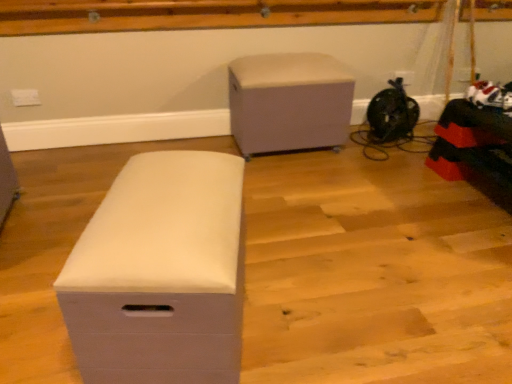
What do you see at coordinates (160, 273) in the screenshot? The height and width of the screenshot is (384, 512). I see `matte white storage box at center, marked as the 2th furniture in a back-to-front arrangement` at bounding box center [160, 273].

In order to click on matte white storage box at center, marked as the 2th furniture in a back-to-front arrangement in this screenshot , I will do `click(160, 273)`.

Where is `beige fabric ottoman at center, acting as the 1th furniture starting from the top`? Image resolution: width=512 pixels, height=384 pixels. beige fabric ottoman at center, acting as the 1th furniture starting from the top is located at coordinates (289, 102).

What is the approximate width of beige fabric ottoman at center, which is the second furniture from front to back?

It is 16.65 inches.

The image size is (512, 384). Describe the element at coordinates (289, 102) in the screenshot. I see `beige fabric ottoman at center, acting as the 1th furniture starting from the top` at that location.

Image resolution: width=512 pixels, height=384 pixels. What are the coordinates of `matte white storage box at center, marked as the 2th furniture in a back-to-front arrangement` in the screenshot? It's located at (160, 273).

Based on their positions, is beige fabric ottoman at center, positioned as the second furniture in left-to-right order, located to the left or right of matte white storage box at center, arranged as the first furniture when viewed from the left?

beige fabric ottoman at center, positioned as the second furniture in left-to-right order, is to the right of matte white storage box at center, arranged as the first furniture when viewed from the left.

Looking at this image, is beige fabric ottoman at center, marked as the 1th furniture in a right-to-left arrangement, in front of matte white storage box at center, which is counted as the second furniture, starting from the top?

No, beige fabric ottoman at center, marked as the 1th furniture in a right-to-left arrangement, is further to the viewer.

Considering the points (310, 132) and (212, 254), which point is in front, point (310, 132) or point (212, 254)?

Positioned in front is point (212, 254).

From the image's perspective, which one is positioned lower, beige fabric ottoman at center, marked as the 1th furniture in a right-to-left arrangement, or matte white storage box at center, the second furniture from the right?

matte white storage box at center, the second furniture from the right.

From a real-world perspective, is beige fabric ottoman at center, which appears as the first furniture when viewed from the back, on top of matte white storage box at center, acting as the first furniture starting from the bottom?

Correct, in the physical world, beige fabric ottoman at center, which appears as the first furniture when viewed from the back, is higher than matte white storage box at center, acting as the first furniture starting from the bottom.

Does beige fabric ottoman at center, marked as the 1th furniture in a right-to-left arrangement, have a greater width compared to matte white storage box at center, acting as the first furniture starting from the bottom?

Yes, beige fabric ottoman at center, marked as the 1th furniture in a right-to-left arrangement, is wider than matte white storage box at center, acting as the first furniture starting from the bottom.

Considering the sizes of beige fabric ottoman at center, positioned as the second furniture in left-to-right order, and matte white storage box at center, the first furniture in the front-to-back sequence, in the image, is beige fabric ottoman at center, positioned as the second furniture in left-to-right order, taller or shorter than matte white storage box at center, the first furniture in the front-to-back sequence,?

In the image, beige fabric ottoman at center, positioned as the second furniture in left-to-right order, appears to be taller than matte white storage box at center, the first furniture in the front-to-back sequence.

Based on their sizes in the image, would you say beige fabric ottoman at center, which is the second furniture from front to back, is bigger or smaller than matte white storage box at center, the first furniture in the front-to-back sequence?

Considering their sizes, beige fabric ottoman at center, which is the second furniture from front to back, takes up more space than matte white storage box at center, the first furniture in the front-to-back sequence.

Is beige fabric ottoman at center, marked as the 1th furniture in a right-to-left arrangement, inside the boundaries of matte white storage box at center, marked as the 2th furniture in a back-to-front arrangement, or outside?

beige fabric ottoman at center, marked as the 1th furniture in a right-to-left arrangement, lies outside matte white storage box at center, marked as the 2th furniture in a back-to-front arrangement.

Are beige fabric ottoman at center, which appears as the first furniture when viewed from the back, and matte white storage box at center, the second furniture from the right, located far from each other?

Yes, beige fabric ottoman at center, which appears as the first furniture when viewed from the back, and matte white storage box at center, the second furniture from the right, are quite far apart.

Is beige fabric ottoman at center, which is counted as the second furniture, starting from the bottom, aimed at matte white storage box at center, arranged as the first furniture when viewed from the left?

Yes, beige fabric ottoman at center, which is counted as the second furniture, starting from the bottom, faces towards matte white storage box at center, arranged as the first furniture when viewed from the left.

Can you tell me how much beige fabric ottoman at center, marked as the 1th furniture in a right-to-left arrangement, and matte white storage box at center, acting as the first furniture starting from the bottom, differ in facing direction?

104 degrees.

How much distance is there between beige fabric ottoman at center, acting as the 1th furniture starting from the top, and matte white storage box at center, arranged as the first furniture when viewed from the left?

They are 1.32 meters apart.

Where is `furniture above the matte white storage box at center, which is counted as the second furniture, starting from the top (from the image's perspective)`? This screenshot has height=384, width=512. furniture above the matte white storage box at center, which is counted as the second furniture, starting from the top (from the image's perspective) is located at coordinates (289, 102).

Considering the positions of objects matte white storage box at center, which is counted as the second furniture, starting from the top, and beige fabric ottoman at center, which is counted as the second furniture, starting from the bottom, in the image provided, who is more to the right, matte white storage box at center, which is counted as the second furniture, starting from the top, or beige fabric ottoman at center, which is counted as the second furniture, starting from the bottom,?

beige fabric ottoman at center, which is counted as the second furniture, starting from the bottom.

Relative to beige fabric ottoman at center, positioned as the second furniture in left-to-right order, is matte white storage box at center, the second furniture from the right, in front or behind?

In the image, matte white storage box at center, the second furniture from the right, appears in front of beige fabric ottoman at center, positioned as the second furniture in left-to-right order.

Is point (190, 273) farther from viewer compared to point (333, 87)?

No, (190, 273) is closer to viewer.

From the image's perspective, between matte white storage box at center, marked as the 2th furniture in a back-to-front arrangement, and beige fabric ottoman at center, which appears as the first furniture when viewed from the back, who is located below?

From the image's view, matte white storage box at center, marked as the 2th furniture in a back-to-front arrangement, is below.

From a real-world perspective, is matte white storage box at center, the first furniture in the front-to-back sequence, positioned under beige fabric ottoman at center, positioned as the second furniture in left-to-right order, based on gravity?

Indeed, from a real-world perspective, matte white storage box at center, the first furniture in the front-to-back sequence, is positioned beneath beige fabric ottoman at center, positioned as the second furniture in left-to-right order.

Does matte white storage box at center, marked as the 2th furniture in a back-to-front arrangement, have a lesser width compared to beige fabric ottoman at center, marked as the 1th furniture in a right-to-left arrangement?

Correct, the width of matte white storage box at center, marked as the 2th furniture in a back-to-front arrangement, is less than that of beige fabric ottoman at center, marked as the 1th furniture in a right-to-left arrangement.

Considering the sizes of objects matte white storage box at center, the first furniture in the front-to-back sequence, and beige fabric ottoman at center, which is the second furniture from front to back, in the image provided, who is taller, matte white storage box at center, the first furniture in the front-to-back sequence, or beige fabric ottoman at center, which is the second furniture from front to back,?

beige fabric ottoman at center, which is the second furniture from front to back, is taller.

In the scene shown: Which of these two, matte white storage box at center, which is counted as the second furniture, starting from the top, or beige fabric ottoman at center, which is counted as the second furniture, starting from the bottom, is bigger?

beige fabric ottoman at center, which is counted as the second furniture, starting from the bottom.

Is matte white storage box at center, arranged as the first furniture when viewed from the left, inside the boundaries of beige fabric ottoman at center, which appears as the first furniture when viewed from the back, or outside?

matte white storage box at center, arranged as the first furniture when viewed from the left, is spatially situated outside beige fabric ottoman at center, which appears as the first furniture when viewed from the back.

Is the surface of matte white storage box at center, marked as the 2th furniture in a back-to-front arrangement, in direct contact with beige fabric ottoman at center, which is counted as the second furniture, starting from the bottom?

matte white storage box at center, marked as the 2th furniture in a back-to-front arrangement, and beige fabric ottoman at center, which is counted as the second furniture, starting from the bottom, are not in contact.

Is matte white storage box at center, arranged as the first furniture when viewed from the left, oriented towards beige fabric ottoman at center, which is counted as the second furniture, starting from the bottom?

A: No, matte white storage box at center, arranged as the first furniture when viewed from the left, is not oriented towards beige fabric ottoman at center, which is counted as the second furniture, starting from the bottom.

This screenshot has width=512, height=384. In order to click on furniture lying behind the matte white storage box at center, marked as the 2th furniture in a back-to-front arrangement in this screenshot , I will do `click(289, 102)`.

Where is `furniture located above the matte white storage box at center, acting as the first furniture starting from the bottom (from the image's perspective)`? furniture located above the matte white storage box at center, acting as the first furniture starting from the bottom (from the image's perspective) is located at coordinates point(289,102).

Find the location of a particular element. This screenshot has height=384, width=512. furniture to the left of beige fabric ottoman at center, positioned as the second furniture in left-to-right order is located at coordinates (160, 273).